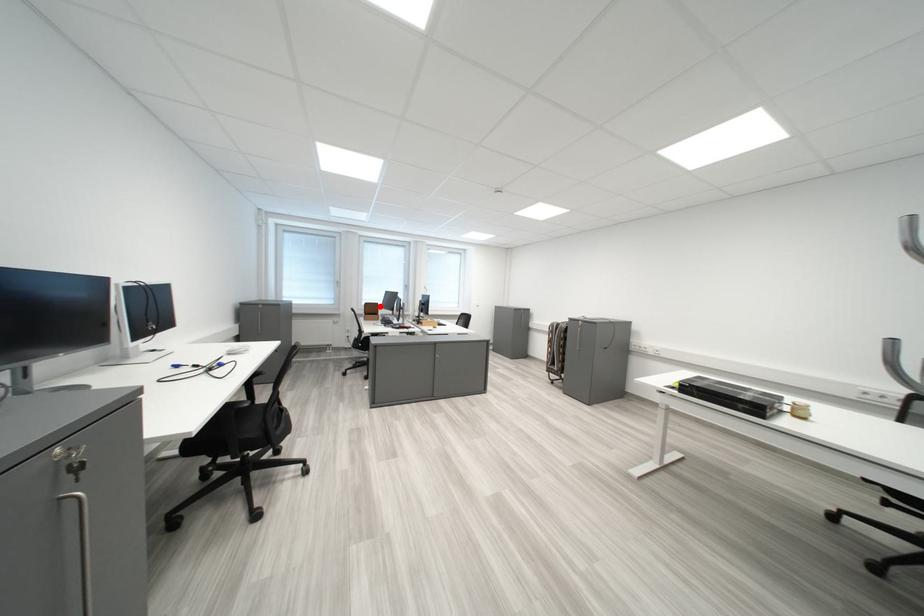
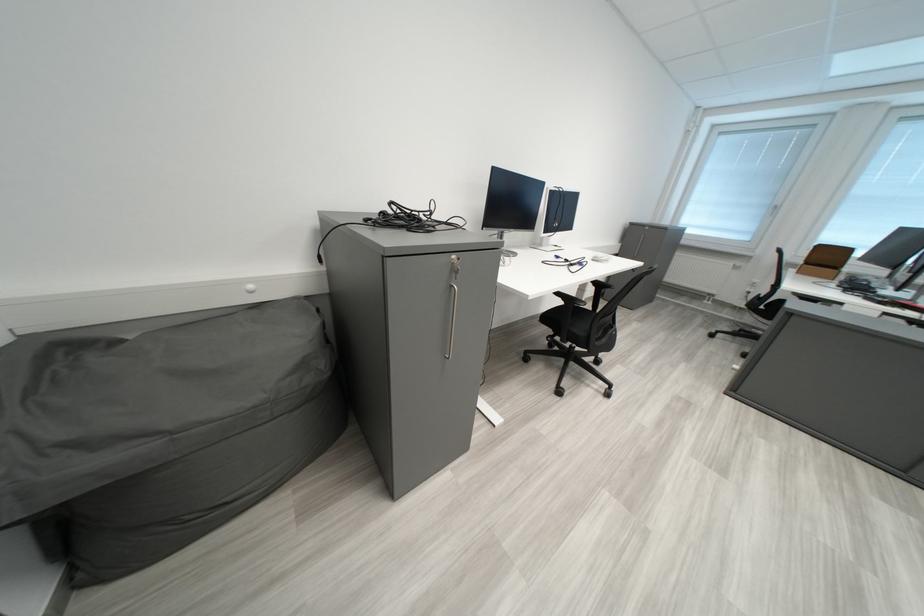
Question: I am providing you with two images of the same scene from different viewpoints. In image1, a red point is highlighted. Considering the same 3D point in image2, which of the following is correct?

Choices:
 (A) It is closer
 (B) It is farther

Answer: (B)